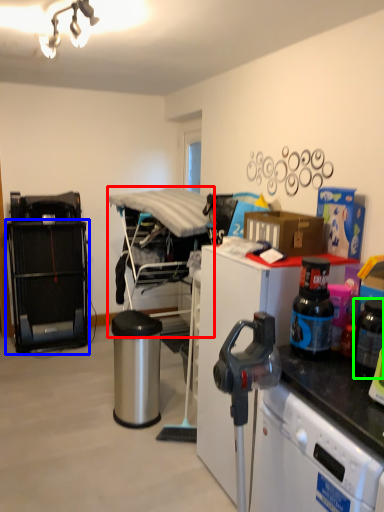
Question: Considering the real-world distances, which object is farthest from furniture (highlighted by a red box)? cabinetry (highlighted by a blue box) or appliance (highlighted by a green box)?

Choices:
 (A) cabinetry
 (B) appliance

Answer: (B)